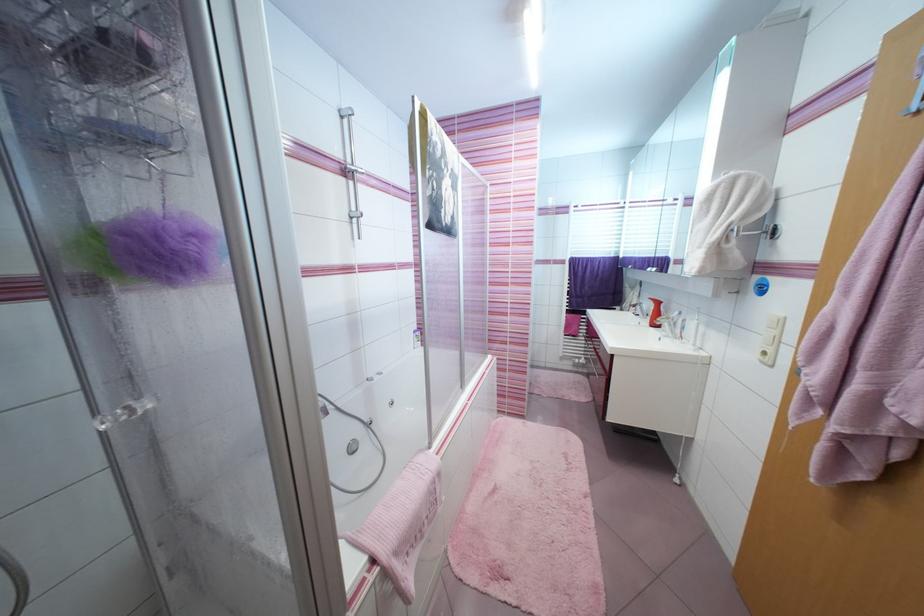
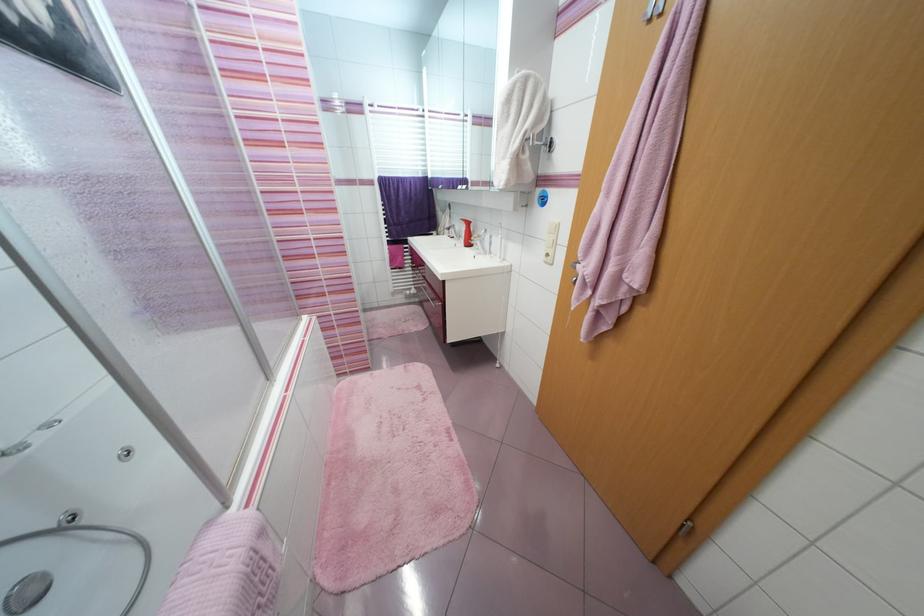
Where in the second image is the point corresponding to the point at 734,233 from the first image?

(530, 140)